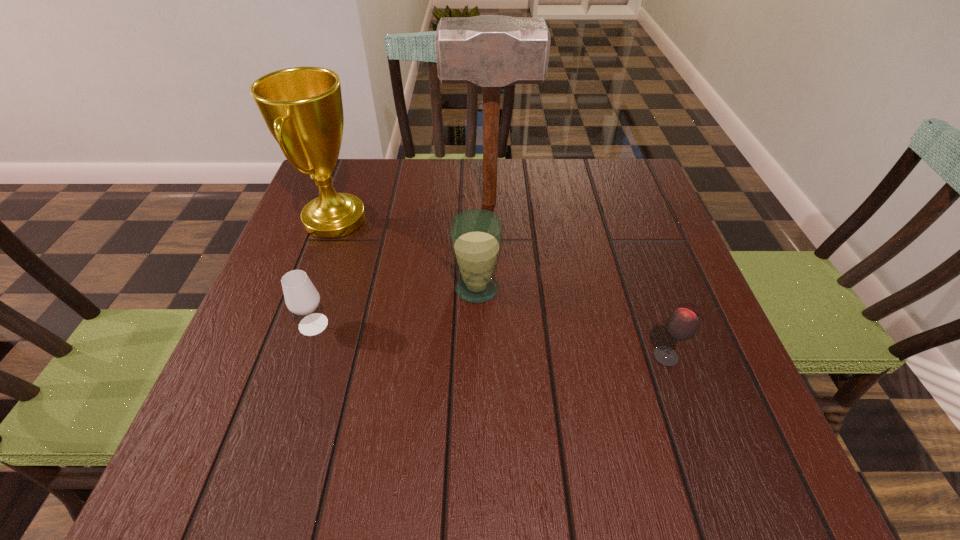
The image size is (960, 540). Find the location of `the tallest object`. the tallest object is located at coordinates (491, 51).

You are a GUI agent. You are given a task and a screenshot of the screen. Output one action in this format:
    pyautogui.click(x=<x>, y=<y>)
    Task: Click on the fourth shortest object
    
    Given the screenshot: What is the action you would take?
    pyautogui.click(x=302, y=107)

Locate an element on the screen. The width and height of the screenshot is (960, 540). the third shortest object is located at coordinates (476, 235).

The image size is (960, 540). Identify the location of the second glass from right to left. (476, 235).

This screenshot has height=540, width=960. Find the location of `the nearest object`. the nearest object is located at coordinates (682, 324).

The width and height of the screenshot is (960, 540). What are the coordinates of `the rightmost glass` in the screenshot? It's located at (682, 324).

Identify the location of the second nearest object. Image resolution: width=960 pixels, height=540 pixels. (301, 297).

I want to click on the leftmost glass, so click(x=301, y=297).

The width and height of the screenshot is (960, 540). What are the coordinates of `free point located on the striking face of the tallest object` in the screenshot? It's located at (356, 204).

Locate an element on the screen. Image resolution: width=960 pixels, height=540 pixels. vacant area located on the striking face of the tallest object is located at coordinates (352, 204).